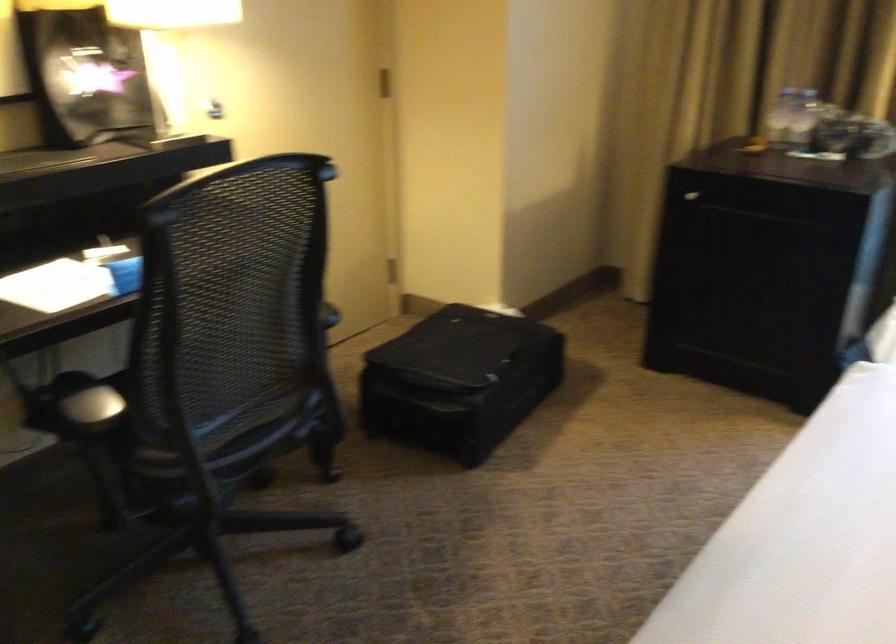
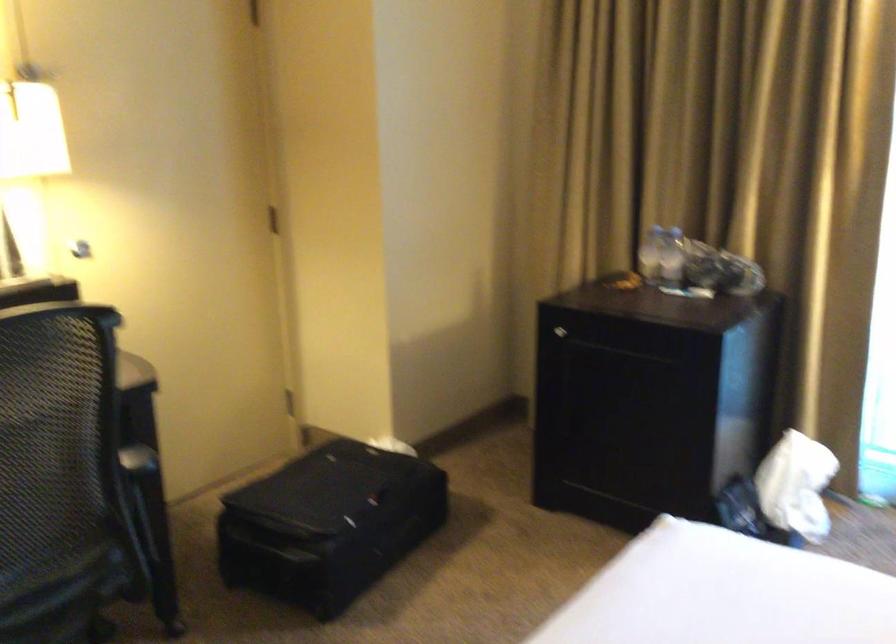
In the second image, find the point that corresponds to [470,379] in the first image.

(328, 524)